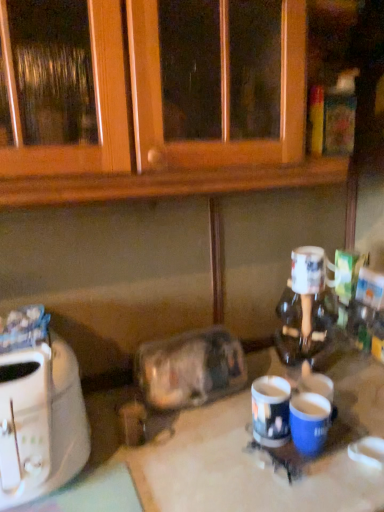
This screenshot has width=384, height=512. I want to click on empty space that is to the right of white plastic toaster at left, so click(x=128, y=468).